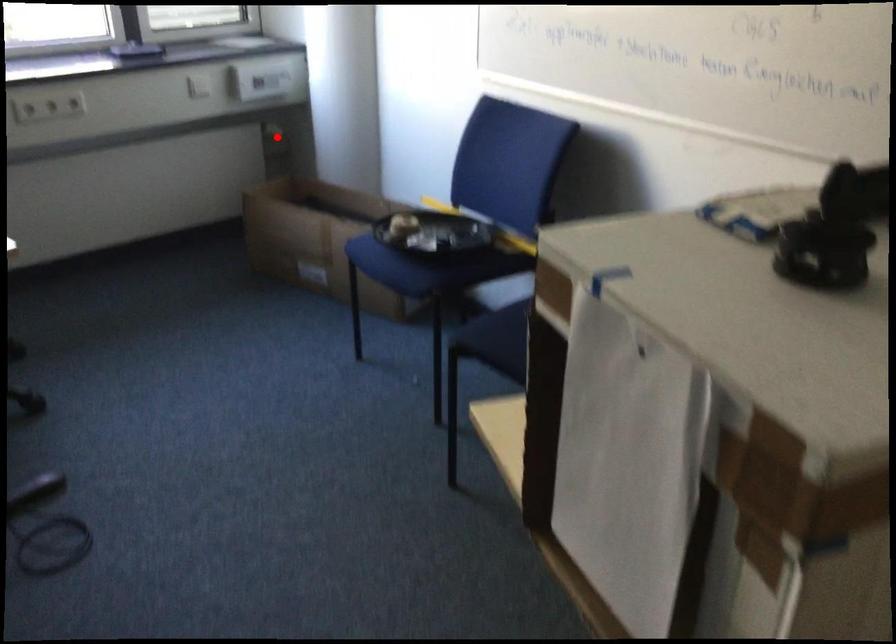
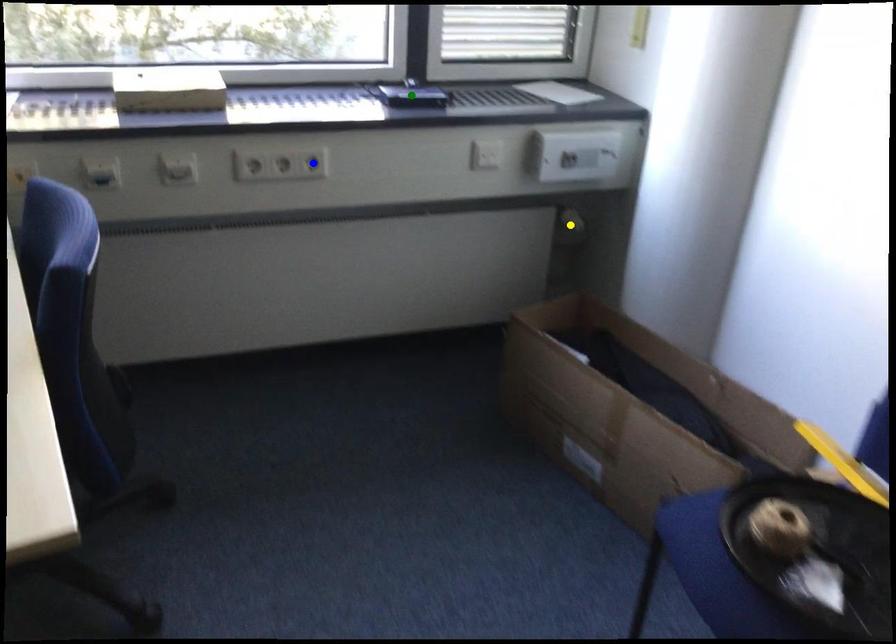
Question: I am providing you with two images of the same scene from different viewpoints. A red point is marked on the first image. You are given multiple points on the second image. Which mark in image 2 goes with the point in image 1?

Choices:
 (A) yellow point
 (B) green point
 (C) blue point

Answer: (A)